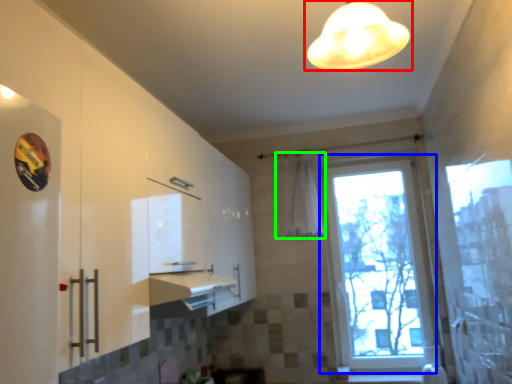
Question: Considering the real-world distances, which object is farthest from lamp (highlighted by a red box)? window (highlighted by a blue box) or curtain (highlighted by a green box)?

Choices:
 (A) window
 (B) curtain

Answer: (A)